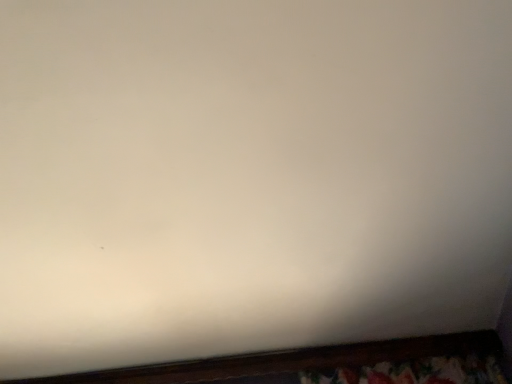
This screenshot has width=512, height=384. I want to click on brown wood frame at bottom, so click(286, 360).

Describe the element at coordinates (286, 360) in the screenshot. I see `brown wood frame at bottom` at that location.

Where is `brown wood frame at bottom`? brown wood frame at bottom is located at coordinates coord(286,360).